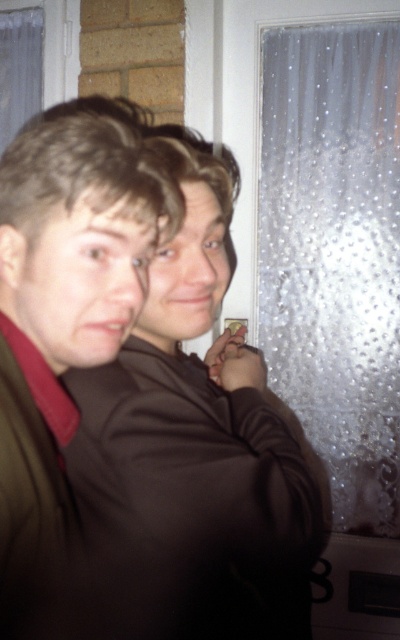
Question: Is brown matte jacket at center closer to the viewer compared to frosted glass curtain at right?

Choices:
 (A) yes
 (B) no

Answer: (A)

Question: Which point appears closest to the camera in this image?

Choices:
 (A) (237, 620)
 (B) (318, 416)

Answer: (A)

Question: Can you confirm if brown matte jacket at center is wider than frosted glass curtain at right?

Choices:
 (A) yes
 (B) no

Answer: (B)

Question: Among these points, which one is farthest from the camera?

Choices:
 (A) (154, 604)
 (B) (335, 134)

Answer: (B)

Question: Can you confirm if brown matte jacket at center is wider than frosted glass curtain at right?

Choices:
 (A) no
 (B) yes

Answer: (A)